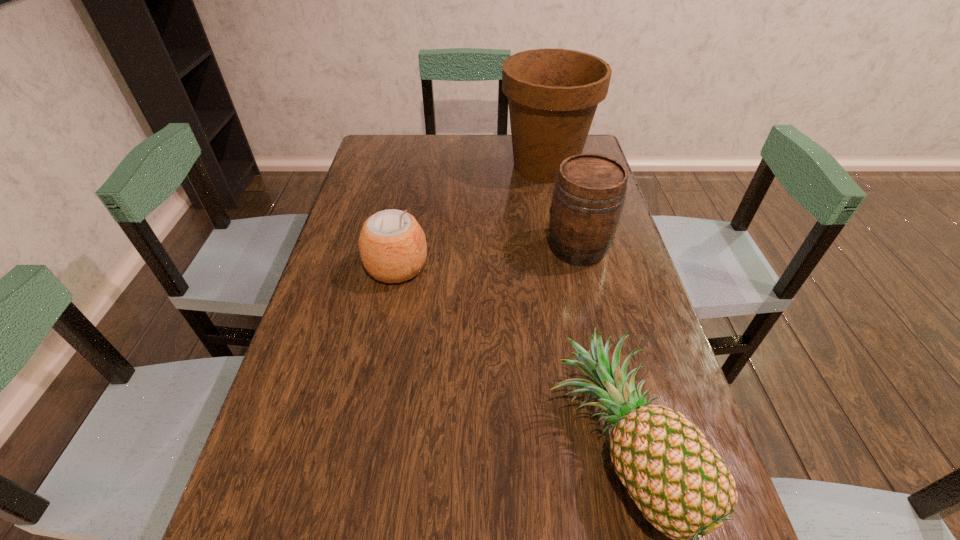
This screenshot has height=540, width=960. I want to click on the farthest object, so [x=553, y=94].

This screenshot has width=960, height=540. I want to click on flowerpot, so click(x=553, y=94).

Identify the location of cider. Image resolution: width=960 pixels, height=540 pixels. (589, 193).

I want to click on the leftmost object, so click(x=392, y=245).

Locate an element on the screen. free region located on the front of the tallest object is located at coordinates (564, 258).

Locate an element on the screen. vacant point located on the side of the third shortest object near the bung hole is located at coordinates (x=400, y=247).

Where is `vacant space located on the side of the third shortest object near the bung hole`? This screenshot has width=960, height=540. vacant space located on the side of the third shortest object near the bung hole is located at coordinates (513, 247).

Where is `blank space located 0.110m on the side of the third shortest object near the bung hole`? The height and width of the screenshot is (540, 960). blank space located 0.110m on the side of the third shortest object near the bung hole is located at coordinates (505, 247).

Find the location of `free region located on the right of the leftmost object`. free region located on the right of the leftmost object is located at coordinates (451, 267).

Identify the location of object that is at the far edge. (553, 94).